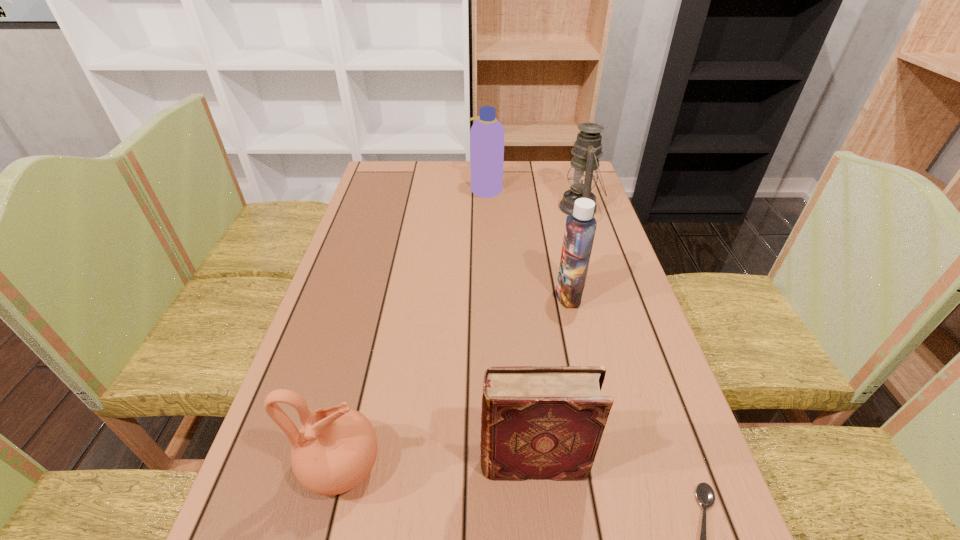
I want to click on unoccupied position between the hardback book and the farther shampoo, so click(x=510, y=326).

Where is `free spot between the nearer shampoo and the leftmost object`? Image resolution: width=960 pixels, height=540 pixels. free spot between the nearer shampoo and the leftmost object is located at coordinates (455, 381).

Identify which object is the third nearest to the left shampoo. Please provide its 2D coordinates. Your answer should be formatted as a tuple, i.e. [(x, y)], where the tuple contains the x and y coordinates of a point satisfying the conditions above.

[(335, 449)]

Where is `the fourth closest object to the hardback book`? the fourth closest object to the hardback book is located at coordinates pyautogui.click(x=583, y=173).